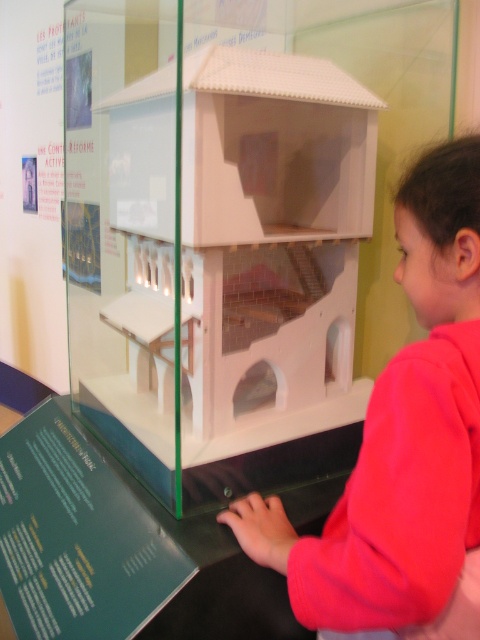
Question: Is transparent plastic model house at center wider than pink fleece jacket at lower right?

Choices:
 (A) yes
 (B) no

Answer: (A)

Question: Is transparent plastic model house at center closer to the viewer compared to pink fleece jacket at lower right?

Choices:
 (A) yes
 (B) no

Answer: (B)

Question: Does transparent plastic model house at center come in front of pink fleece jacket at lower right?

Choices:
 (A) yes
 (B) no

Answer: (B)